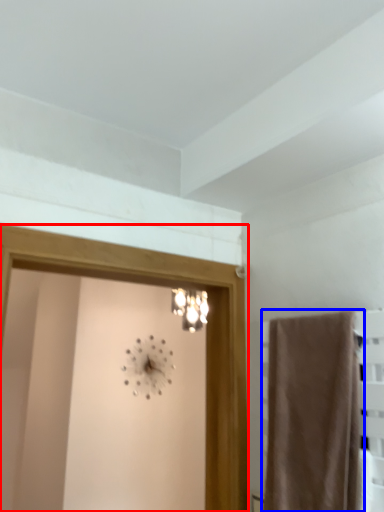
Question: Which point is further to the camera, screen door (highlighted by a red box) or curtain (highlighted by a blue box)?

Choices:
 (A) screen door
 (B) curtain

Answer: (A)